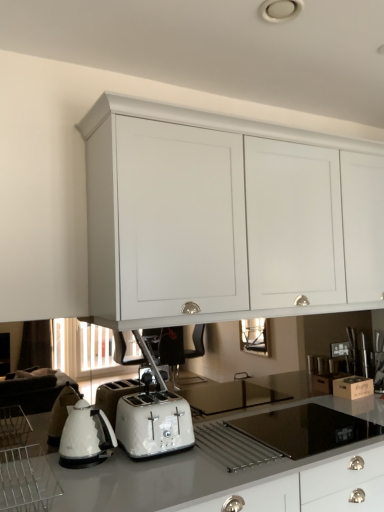
The width and height of the screenshot is (384, 512). I want to click on blank space to the left of white glossy kettle at lower left, so click(35, 462).